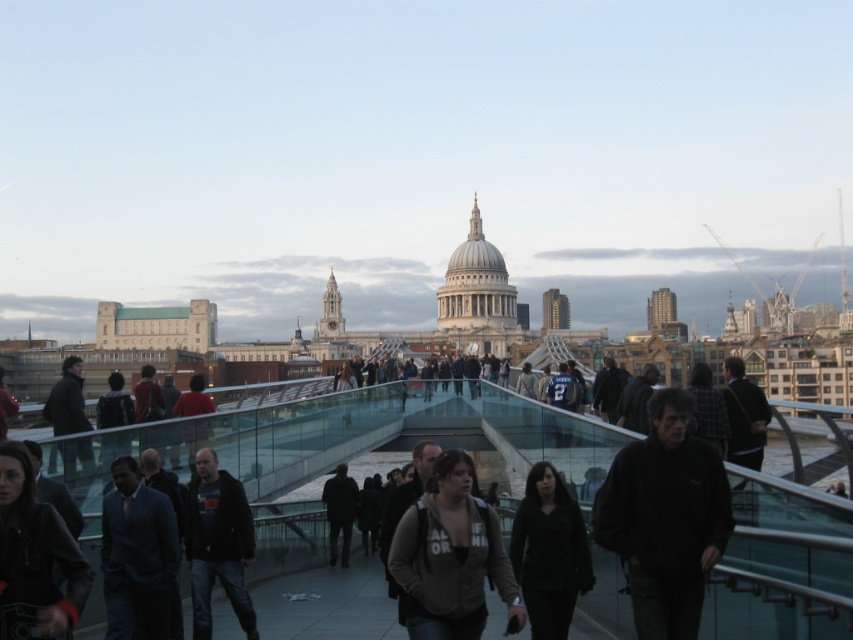
What is located at the point with coordinates (137, 556) on the Millennium Bridge?

The dark blue suit at center is located at point (137, 556).

You are a photographer standing on the Millennium Bridge in London. You want to capture a photo of the dark blue suit at center and the dark brown leather jacket at left. Which person should you focus on first if you want to include both in your frame without moving the camera?

You should focus on the dark blue suit at center first because it is taller than the dark brown leather jacket at left, allowing you to frame both subjects effectively without adjusting the camera position.